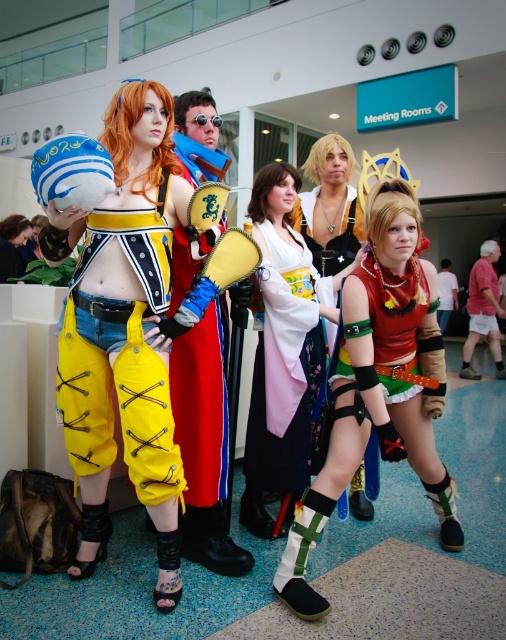
You are a photographer at a cosplay event and need to capture a photo of both the yellow fabric pants at center and the silky white kimono at center. Based on their positions, which one should you focus on first to ensure both are in frame?

The yellow fabric pants at center should be focused on first since it is positioned to the left of the silky white kimono at center, allowing the photographer to frame both from left to right.

You are a photographer at a convention and want to take a photo of the yellow leather pants at center and the pink fabric shirt at center. Which object should you focus on first to ensure both are in sharp focus?

The yellow leather pants at center is closer to the viewer than the pink fabric shirt at center, so you should focus on the yellow leather pants at center first to ensure both are in sharp focus.